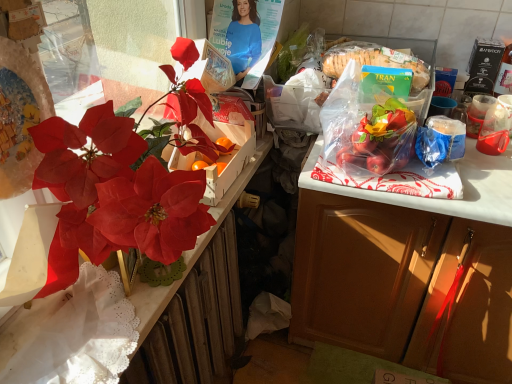
Question: Is matte red flower at left completely or partially inside transparent plastic cup at right, the second coffee cup from the left?

Choices:
 (A) no
 (B) yes

Answer: (A)

Question: Does transparent plastic cup at right, the second coffee cup from the left, turn towards matte red flower at left?

Choices:
 (A) yes
 (B) no

Answer: (B)

Question: Is transparent plastic cup at right, the 1th coffee cup viewed from the right, closer to camera compared to matte red flower at left?

Choices:
 (A) yes
 (B) no

Answer: (B)

Question: From a real-world perspective, is transparent plastic cup at right, the second coffee cup from the left, positioned over matte red flower at left based on gravity?

Choices:
 (A) yes
 (B) no

Answer: (B)

Question: Considering the relative sizes of transparent plastic cup at right, the 1th coffee cup viewed from the right, and matte red flower at left in the image provided, is transparent plastic cup at right, the 1th coffee cup viewed from the right, thinner than matte red flower at left?

Choices:
 (A) no
 (B) yes

Answer: (B)

Question: Is transparent plastic cup at right, the 1th coffee cup viewed from the right, at the right side of matte red flower at left?

Choices:
 (A) no
 (B) yes

Answer: (B)

Question: Is white lace wrapping paper at left completely or partially outside of matte brown cabinet at right?

Choices:
 (A) no
 (B) yes

Answer: (B)

Question: From a real-world perspective, is white lace wrapping paper at left positioned over matte brown cabinet at right based on gravity?

Choices:
 (A) yes
 (B) no

Answer: (A)

Question: Can you confirm if white lace wrapping paper at left is thinner than matte brown cabinet at right?

Choices:
 (A) yes
 (B) no

Answer: (A)

Question: From the image's perspective, would you say white lace wrapping paper at left is shown under matte brown cabinet at right?

Choices:
 (A) yes
 (B) no

Answer: (A)

Question: Is white lace wrapping paper at left smaller than matte brown cabinet at right?

Choices:
 (A) no
 (B) yes

Answer: (B)

Question: Does white lace wrapping paper at left appear on the right side of matte brown cabinet at right?

Choices:
 (A) no
 (B) yes

Answer: (A)

Question: Does white lace wrapping paper at left appear on the left side of transparent plastic coffee cup at upper right, which is the second coffee cup in right-to-left order?

Choices:
 (A) yes
 (B) no

Answer: (A)